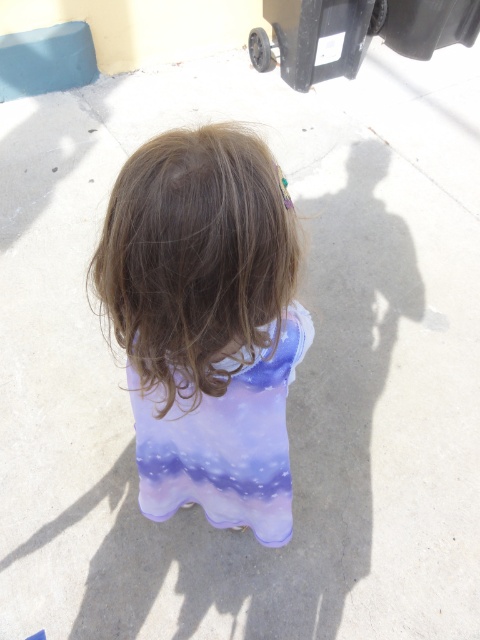
Question: Can you confirm if brown smooth hair at center is smaller than purple fabric dress at center?

Choices:
 (A) yes
 (B) no

Answer: (A)

Question: Which object is farther from the camera taking this photo?

Choices:
 (A) brown smooth hair at center
 (B) purple fabric dress at center

Answer: (B)

Question: Which of the following is the closest to the observer?

Choices:
 (A) brown smooth hair at center
 (B) purple fabric dress at center

Answer: (A)

Question: Is brown smooth hair at center bigger than purple fabric dress at center?

Choices:
 (A) no
 (B) yes

Answer: (A)

Question: From the image, what is the correct spatial relationship of brown smooth hair at center in relation to purple fabric dress at center?

Choices:
 (A) right
 (B) left

Answer: (B)